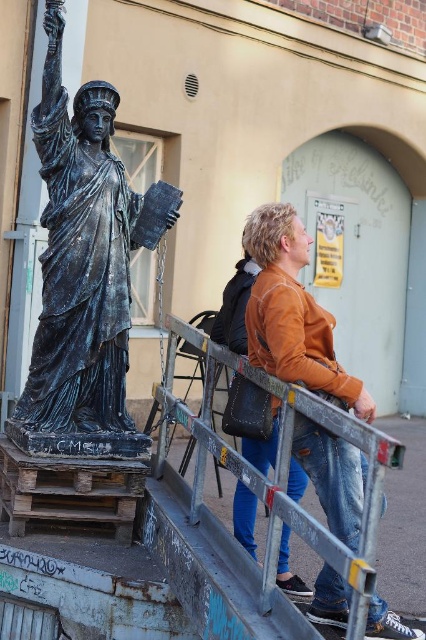
Question: Is bronze statue at left positioned at the back of orange leather jacket at upper right?

Choices:
 (A) yes
 (B) no

Answer: (A)

Question: Is bronze statue at left to the right of orange leather jacket at upper right from the viewer's perspective?

Choices:
 (A) no
 (B) yes

Answer: (A)

Question: Observing the image, what is the correct spatial positioning of bronze statue at left in reference to orange leather jacket at upper right?

Choices:
 (A) left
 (B) right

Answer: (A)

Question: Which point appears farthest from the camera in this image?

Choices:
 (A) (287, 307)
 (B) (48, 403)

Answer: (B)